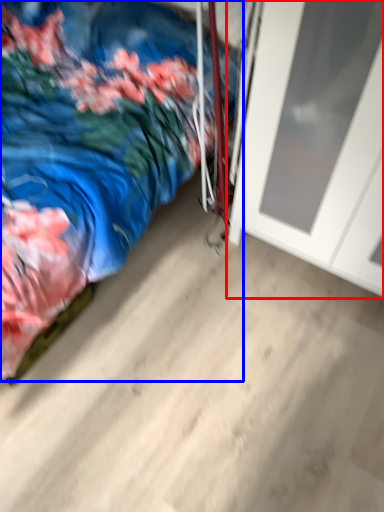
Question: Which object is closer to the camera taking this photo, door (highlighted by a red box) or bed (highlighted by a blue box)?

Choices:
 (A) door
 (B) bed

Answer: (B)